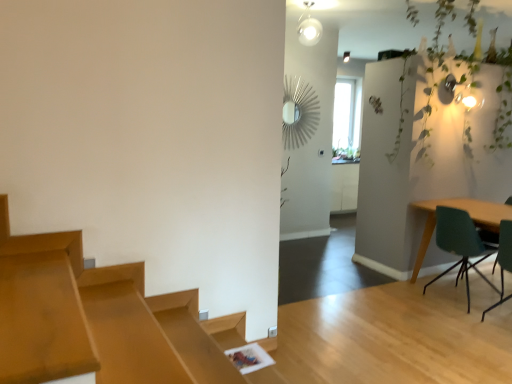
Question: From their relative heights in the image, would you say green fabric chair at right, the 2th chair viewed from the back, is taller or shorter than green leafy plant at upper right?

Choices:
 (A) short
 (B) tall

Answer: (A)

Question: Is green fabric chair at right, placed as the first chair when sorted from front to back, inside the boundaries of green leafy plant at upper right, or outside?

Choices:
 (A) outside
 (B) inside

Answer: (A)

Question: Which is nearer to the teal matte chair at right, which ranks as the 2th chair in front-to-back order?

Choices:
 (A) green leafy plant at upper right
 (B) green fabric chair at right, the 2th chair viewed from the back
 (C) clear glass window at upper center
 (D) teal fabric chair at right

Answer: (D)

Question: Which is farther from the teal fabric chair at right?

Choices:
 (A) green fabric chair at right, placed as the first chair when sorted from front to back
 (B) green leafy plant at upper right
 (C) clear glass window at upper center
 (D) teal matte chair at right, arranged as the first chair when viewed from the back

Answer: (C)